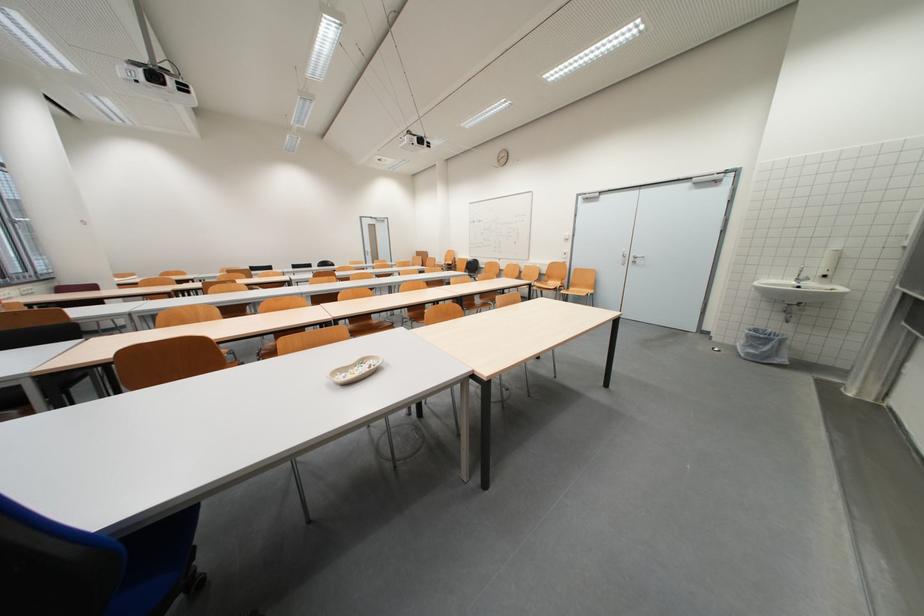
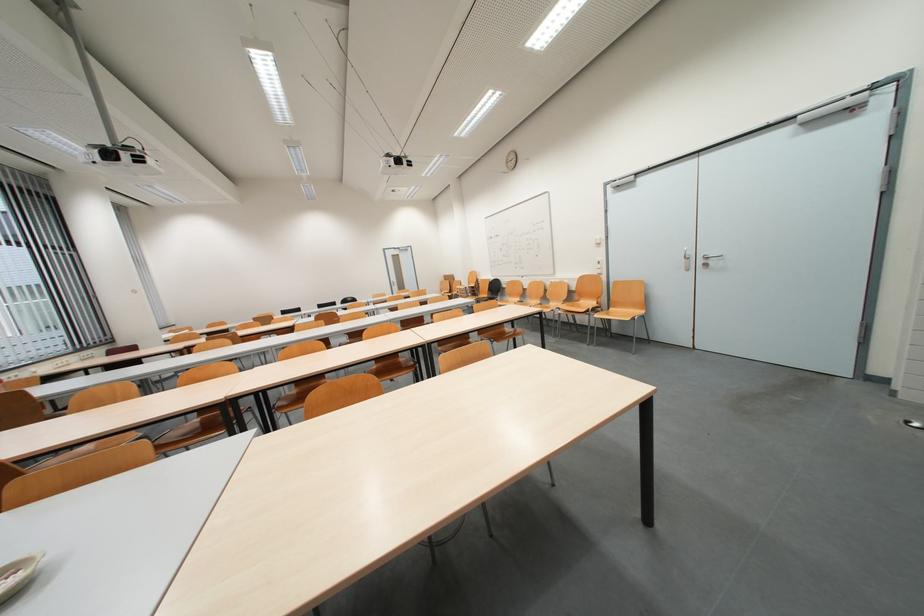
What movement of the cameraman would produce the second image?

The cameraman moved toward right, forward.